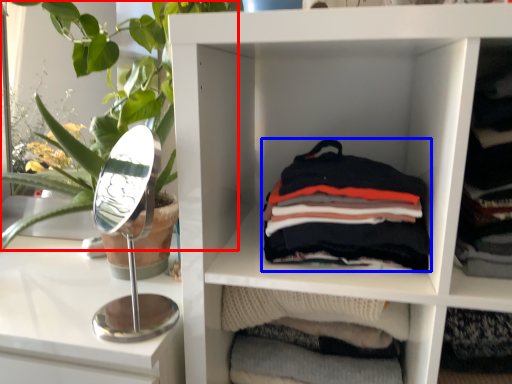
Question: Which of the following is the closest to the observer, plant (highlighted by a red box) or material (highlighted by a blue box)?

Choices:
 (A) plant
 (B) material

Answer: (A)